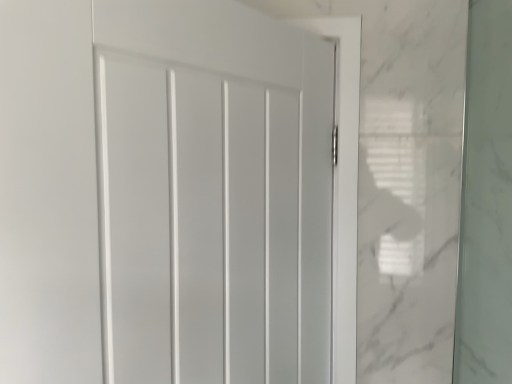
Describe the element at coordinates (213, 194) in the screenshot. I see `white matte door at center` at that location.

What is the approximate width of white matte door at center?

The width of white matte door at center is 6.43 inches.

Where is `white matte door at center`? This screenshot has width=512, height=384. white matte door at center is located at coordinates (213, 194).

Measure the distance between white matte door at center and camera.

A: white matte door at center and camera are 19.86 inches apart from each other.

Find the location of `white matte door at center`. white matte door at center is located at coordinates (213, 194).